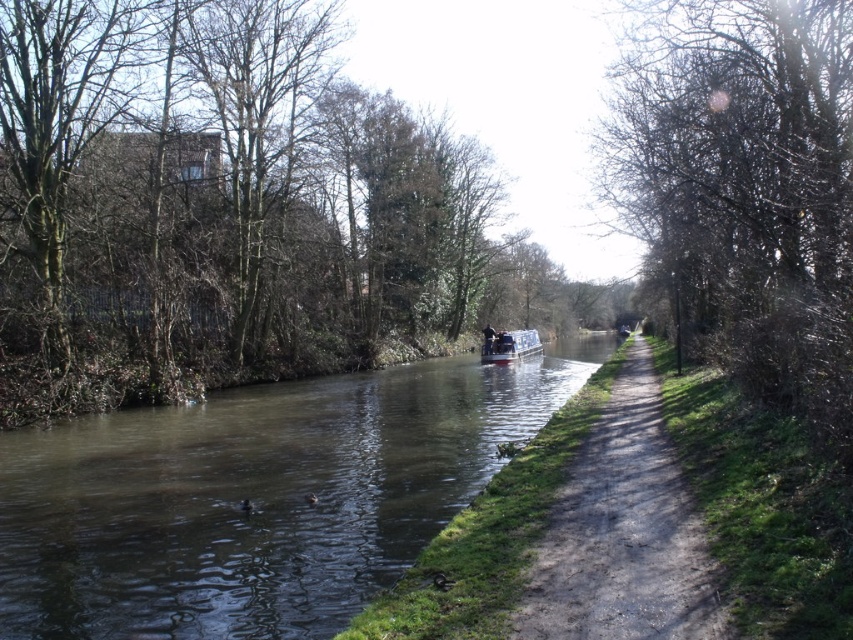
You are standing at the point closer to the camera in the canal scene. Which point are you at, point [426,528] or point [792,70]?

You are at point [426,528] because it is closer to the camera than point [792,70].